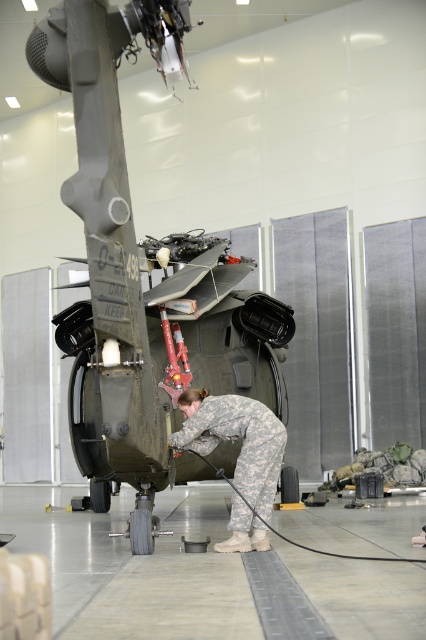
Which is more to the left, green matte helicopter at center or camouflage uniform at center?

Positioned to the left is green matte helicopter at center.

Does green matte helicopter at center appear on the right side of camouflage uniform at center?

A: No, green matte helicopter at center is not to the right of camouflage uniform at center.

Between point (267, 356) and point (270, 497), which one is positioned behind?

Positioned behind is point (267, 356).

The image size is (426, 640). Find the location of `green matte helicopter at center`. green matte helicopter at center is located at coordinates (155, 298).